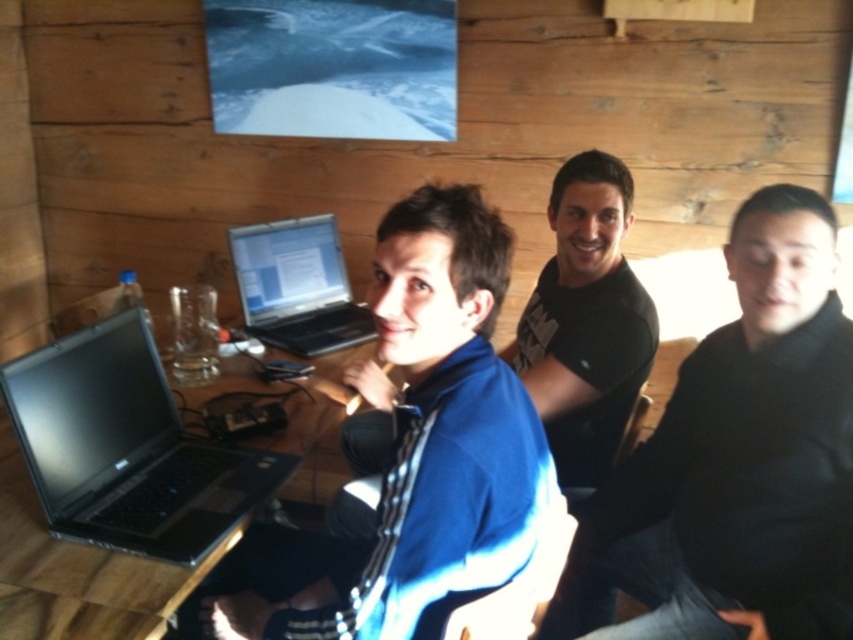
You are standing at the point labeled point [262,328] and want to move to the point labeled point [782,552]. Which direction should you move in to reach your destination?

You should move forward to reach point [782,552] because it is in front of point [262,328].

You are standing in the room and want to reach the point at coordinates (787, 353). Can you estimate how far you need to walk to get there?

The point at coordinates (787, 353) is 3.84 feet away from you, so you need to walk approximately 3.84 feet to reach it.